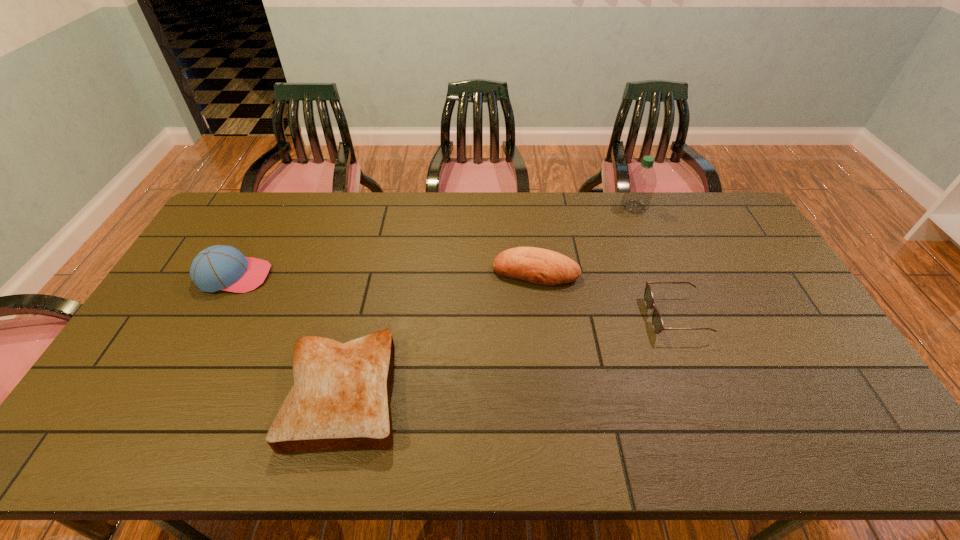
Where is `vacant point located on the front-facing side of the second tallest object`? This screenshot has width=960, height=540. vacant point located on the front-facing side of the second tallest object is located at coordinates (339, 276).

I want to click on vacant space located 0.230m on the right of the third object from left to right, so click(x=650, y=272).

Locate an element on the screen. vacant space situated at the front view of the spectacles is located at coordinates (561, 317).

Locate an element on the screen. This screenshot has width=960, height=540. free region located 0.230m at the front view of the spectacles is located at coordinates (571, 317).

At what (x,y) coordinates should I click in order to perform the action: click on free space located 0.070m at the front view of the spectacles. Please return your answer as a coordinate pair (x, y). Looking at the image, I should click on (625, 317).

Identify the location of vacant space located 0.200m on the back of the nearer bread. (370, 288).

Find the location of a particular element. Image resolution: width=960 pixels, height=540 pixels. object that is at the far edge is located at coordinates (641, 183).

Identify the location of object located at the near edge. (340, 400).

In order to click on object present at the left edge in this screenshot , I will do click(x=221, y=267).

Identify the location of free point at the far edge. Image resolution: width=960 pixels, height=540 pixels. (337, 219).